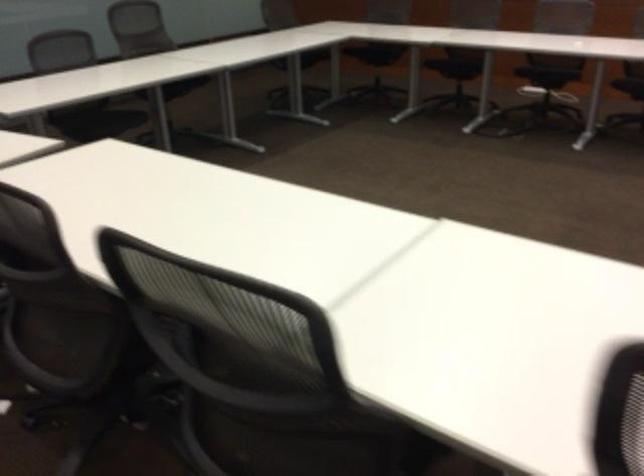
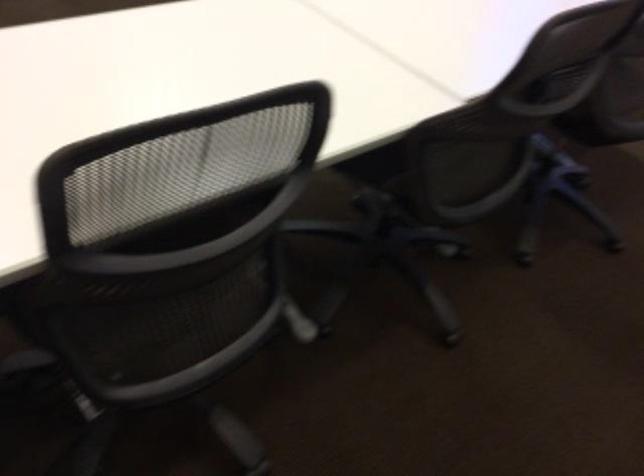
Question: The images are taken continuously from a first-person perspective. In which direction are you moving?

Choices:
 (A) Left
 (B) Right
 (C) Forward
 (D) Backward

Answer: (D)